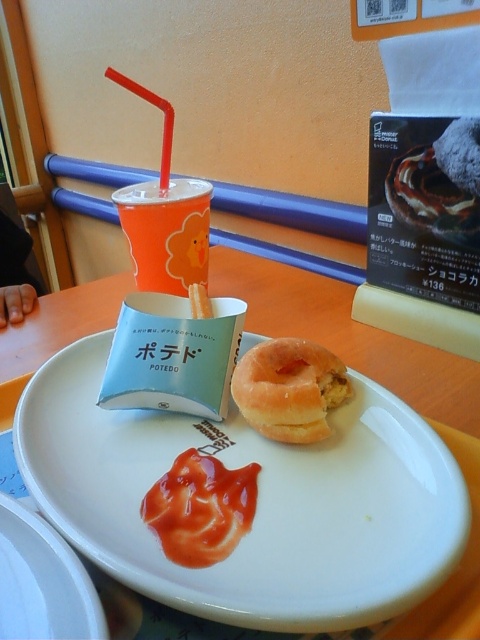
In the scene shown: Who is taller, white glossy plate at center or tomato ketchup at center?

With more height is white glossy plate at center.

Who is positioned more to the left, white glossy plate at center or tomato ketchup at center?

white glossy plate at center is more to the left.

Image resolution: width=480 pixels, height=640 pixels. What do you see at coordinates (256, 502) in the screenshot? I see `white glossy plate at center` at bounding box center [256, 502].

This screenshot has width=480, height=640. Identify the location of white glossy plate at center. pyautogui.click(x=256, y=502).

Does white glossy plate at center appear on the right side of smooth white plate at center?

Correct, you'll find white glossy plate at center to the right of smooth white plate at center.

Is white glossy plate at center positioned behind smooth white plate at center?

Yes, white glossy plate at center is behind smooth white plate at center.

Is point (143, 541) closer to camera compared to point (16, 589)?

No, (143, 541) is behind (16, 589).

Where is `white glossy plate at center`? This screenshot has height=640, width=480. white glossy plate at center is located at coordinates (256, 502).

Can you confirm if smooth white plate at center is wider than tomato ketchup at center?

Yes.

Is smooth white plate at center positioned before tomato ketchup at center?

Yes, smooth white plate at center is closer to the viewer.

The height and width of the screenshot is (640, 480). Find the location of `smooth white plate at center`. smooth white plate at center is located at coordinates (43, 580).

At what (x,y) coordinates should I click in order to perform the action: click on smooth white plate at center. Please return your answer as a coordinate pair (x, y). This screenshot has height=640, width=480. Looking at the image, I should click on (43, 580).